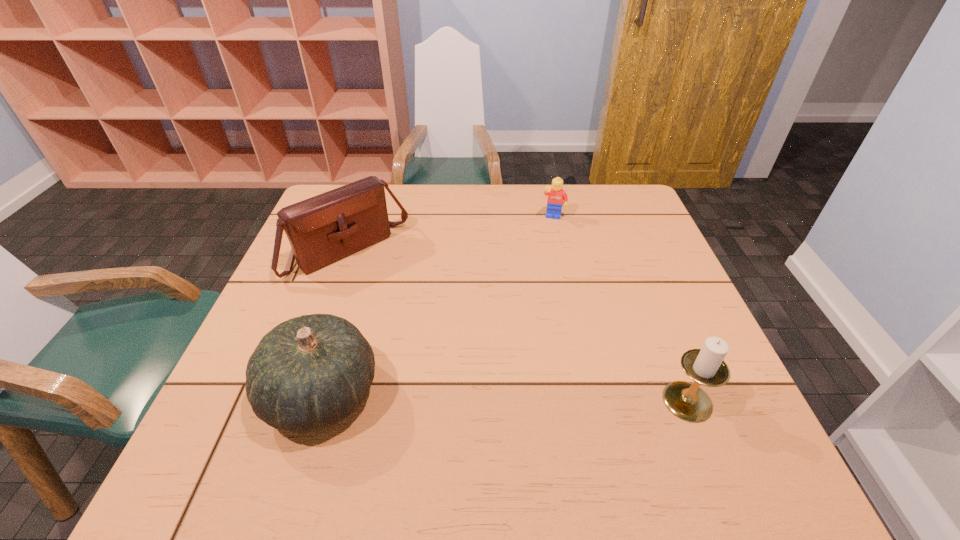
Image resolution: width=960 pixels, height=540 pixels. I want to click on gourd, so coord(308,373).

Locate an element on the screen. The image size is (960, 540). the rightmost object is located at coordinates (706, 366).

Image resolution: width=960 pixels, height=540 pixels. Find the location of `the shortest object`. the shortest object is located at coordinates (556, 195).

Where is `the third object from left to right`? This screenshot has height=540, width=960. the third object from left to right is located at coordinates (556, 195).

Find the location of a particular element. The height and width of the screenshot is (540, 960). shoulder bag is located at coordinates (323, 229).

Where is `vacant space located on the right of the gourd`? The height and width of the screenshot is (540, 960). vacant space located on the right of the gourd is located at coordinates (460, 394).

You are a GUI agent. You are given a task and a screenshot of the screen. Output one action in this format:
    pyautogui.click(x=<x>, y=<y>)
    Task: Click on the free space located on the back of the rightmost object
    Image resolution: width=960 pixels, height=540 pixels.
    Given the screenshot: What is the action you would take?
    pyautogui.click(x=665, y=347)

At what (x,y) coordinates should I click in order to perform the action: click on free space located 0.340m on the face of the farthest object. Please return your answer as a coordinate pair (x, y). The image size is (960, 540). Looking at the image, I should click on (540, 301).

Identify the location of vacant space located 0.380m on the face of the farthest object. (539, 312).

The width and height of the screenshot is (960, 540). Find the location of `free region located on the face of the farthest object`. free region located on the face of the farthest object is located at coordinates (544, 277).